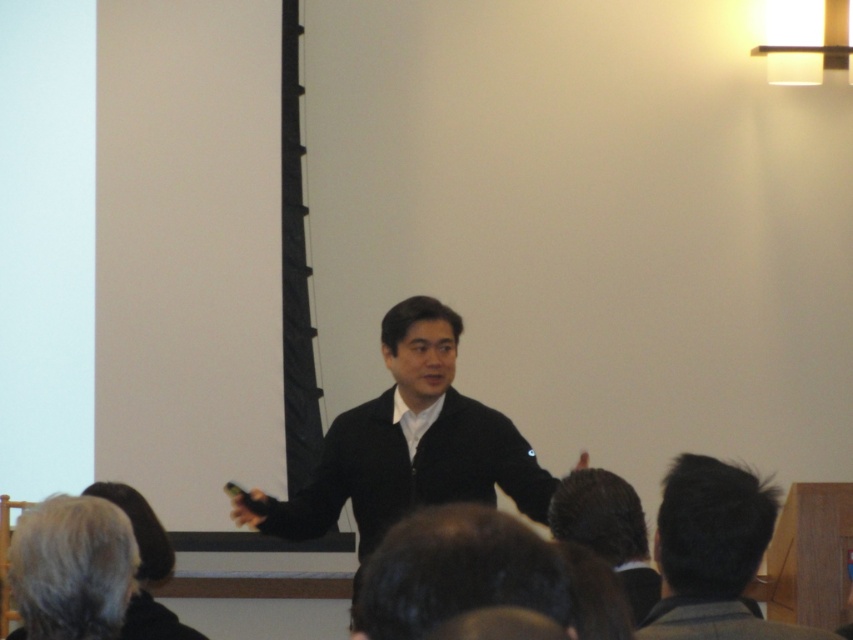
You are an attendee at the presentation. You notice two audience members in the front row. One has dark brown hair at lower right and the other has gray hair at lower left. Which audience member is sitting on the right side from your perspective?

The dark brown hair at lower right is positioned on the right side of gray hair at lower left, so from your perspective as an attendee, the dark brown hair at lower right is sitting on the right side.

Where is the black matte sweater at center located in the image?

The black matte sweater at center is located at the 2D coordinates point [409,444] in the image.